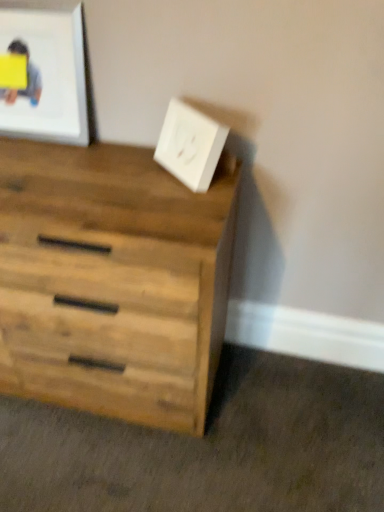
What do you see at coordinates (190, 145) in the screenshot? I see `white matte electric outlet at upper right` at bounding box center [190, 145].

The width and height of the screenshot is (384, 512). I want to click on yellow paper at upper left, so click(x=27, y=77).

Describe the element at coordinates (49, 76) in the screenshot. The height and width of the screenshot is (512, 384). I see `white matte picture frame at upper left` at that location.

Image resolution: width=384 pixels, height=512 pixels. Find the location of `natural wood chest of drawers at lower left`. natural wood chest of drawers at lower left is located at coordinates (112, 282).

How different are the orientations of natural wood chest of drawers at lower left and white matte electric outlet at upper right in degrees?

The angular difference between natural wood chest of drawers at lower left and white matte electric outlet at upper right is 44.2 degrees.

Is natural wood chest of drawers at lower left with white matte electric outlet at upper right?

No, natural wood chest of drawers at lower left is not with white matte electric outlet at upper right.

In the image, is natural wood chest of drawers at lower left positioned in front of or behind white matte electric outlet at upper right?

In the image, natural wood chest of drawers at lower left appears in front of white matte electric outlet at upper right.

From the image's perspective, is white matte electric outlet at upper right on white matte picture frame at upper left?

No, from the image's perspective, white matte electric outlet at upper right is not above white matte picture frame at upper left.

Is white matte electric outlet at upper right far away from white matte picture frame at upper left?

No, white matte electric outlet at upper right is not far from white matte picture frame at upper left.

From their relative heights in the image, would you say white matte electric outlet at upper right is taller or shorter than white matte picture frame at upper left?

Considering their sizes, white matte electric outlet at upper right has less height than white matte picture frame at upper left.

Could you tell me if white matte electric outlet at upper right is turned towards white matte picture frame at upper left?

No, white matte electric outlet at upper right is not oriented towards white matte picture frame at upper left.

Between yellow paper at upper left and white matte picture frame at upper left, which one has smaller size?

Smaller between the two is yellow paper at upper left.

Between point (13, 100) and point (46, 64), which one is positioned in front?

The point (46, 64) is closer to the camera.

Does yellow paper at upper left touch white matte picture frame at upper left?

Yes, yellow paper at upper left is with white matte picture frame at upper left.

Between natural wood chest of drawers at lower left and white matte picture frame at upper left, which one has larger size?

With larger size is natural wood chest of drawers at lower left.

How many degrees apart are the facing directions of natural wood chest of drawers at lower left and white matte picture frame at upper left?

There is a 0.824-degree angle between the facing directions of natural wood chest of drawers at lower left and white matte picture frame at upper left.

Considering the relative sizes of natural wood chest of drawers at lower left and white matte picture frame at upper left in the image provided, is natural wood chest of drawers at lower left thinner than white matte picture frame at upper left?

No, natural wood chest of drawers at lower left is not thinner than white matte picture frame at upper left.

Considering the points (139, 173) and (47, 93), which point is in front, point (139, 173) or point (47, 93)?

The point (139, 173) is more forward.

Based on the photo, is natural wood chest of drawers at lower left inside white matte picture frame at upper left?

Actually, natural wood chest of drawers at lower left is outside white matte picture frame at upper left.

Is white matte picture frame at upper left bigger than natural wood chest of drawers at lower left?

Actually, white matte picture frame at upper left might be smaller than natural wood chest of drawers at lower left.

Is natural wood chest of drawers at lower left at the back of white matte picture frame at upper left?

white matte picture frame at upper left does not have its back to natural wood chest of drawers at lower left.

How distant is natural wood chest of drawers at lower left from yellow paper at upper left?

natural wood chest of drawers at lower left is 23.22 inches from yellow paper at upper left.

Is natural wood chest of drawers at lower left positioned beyond the bounds of yellow paper at upper left?

Yes, natural wood chest of drawers at lower left is not within yellow paper at upper left.

Does natural wood chest of drawers at lower left lie behind yellow paper at upper left?

No, it is not.

Which of these two, natural wood chest of drawers at lower left or yellow paper at upper left, is smaller?

yellow paper at upper left.

From a real-world perspective, which is physically above, white matte picture frame at upper left or yellow paper at upper left?

From a 3D spatial view, white matte picture frame at upper left is above.

The width and height of the screenshot is (384, 512). What are the coordinates of `picture frame on the right of yellow paper at upper left` in the screenshot? It's located at (49, 76).

Can you see white matte picture frame at upper left touching yellow paper at upper left?

Yes, white matte picture frame at upper left is touching yellow paper at upper left.

Would you say white matte picture frame at upper left is to the left or to the right of yellow paper at upper left in the picture?

Based on their positions, white matte picture frame at upper left is located to the right of yellow paper at upper left.

Image resolution: width=384 pixels, height=512 pixels. Find the location of `electric outlet behind the natural wood chest of drawers at lower left`. electric outlet behind the natural wood chest of drawers at lower left is located at coordinates (190, 145).

You are a GUI agent. You are given a task and a screenshot of the screen. Output one action in this format:
    pyautogui.click(x=<x>, y=<y>)
    Task: Click on the picture frame located above the white matte electric outlet at upper right (from a real-world perspective)
    
    Given the screenshot: What is the action you would take?
    pyautogui.click(x=49, y=76)

Looking at the image, which one is located further to yellow paper at upper left, white matte electric outlet at upper right or white matte picture frame at upper left?

white matte electric outlet at upper right.

Estimate the real-world distances between objects in this image. Which object is further from white matte picture frame at upper left, natural wood chest of drawers at lower left or white matte electric outlet at upper right?

Based on the image, natural wood chest of drawers at lower left appears to be further to white matte picture frame at upper left.

Considering their positions, is white matte electric outlet at upper right positioned further to natural wood chest of drawers at lower left than white matte picture frame at upper left?

Among the two, white matte picture frame at upper left is located further to natural wood chest of drawers at lower left.

Looking at the image, which one is located closer to white matte electric outlet at upper right, yellow paper at upper left or natural wood chest of drawers at lower left?

natural wood chest of drawers at lower left.

From the image, which object appears to be nearer to yellow paper at upper left, natural wood chest of drawers at lower left or white matte picture frame at upper left?

white matte picture frame at upper left lies closer to yellow paper at upper left than the other object.

When comparing their distances from natural wood chest of drawers at lower left, does yellow paper at upper left or white matte electric outlet at upper right seem closer?

white matte electric outlet at upper right is positioned closer to the anchor natural wood chest of drawers at lower left.

Considering their positions, is natural wood chest of drawers at lower left positioned further to white matte electric outlet at upper right than yellow paper at upper left?

yellow paper at upper left is further to white matte electric outlet at upper right.

Looking at the image, which one is located further to white matte electric outlet at upper right, yellow paper at upper left or white matte picture frame at upper left?

yellow paper at upper left is further to white matte electric outlet at upper right.

At what (x,y) coordinates should I click in order to perform the action: click on picture frame situated between yellow paper at upper left and white matte electric outlet at upper right from left to right. Please return your answer as a coordinate pair (x, y). This screenshot has height=512, width=384. Looking at the image, I should click on (49, 76).

I want to click on electric outlet between white matte picture frame at upper left and natural wood chest of drawers at lower left from top to bottom, so click(x=190, y=145).

Locate an element on the screen. picture frame that lies between yellow paper at upper left and natural wood chest of drawers at lower left from top to bottom is located at coordinates (49, 76).

What are the coordinates of `electric outlet between yellow paper at upper left and natural wood chest of drawers at lower left in the up-down direction` in the screenshot? It's located at (190, 145).